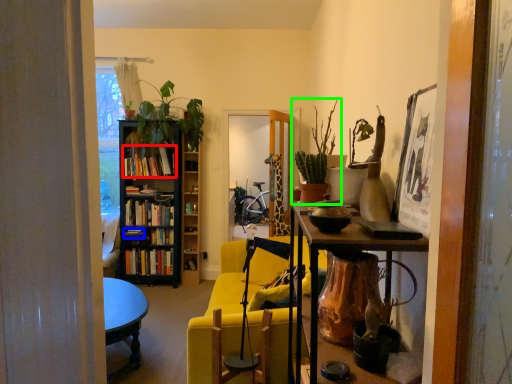
Question: Estimate the real-world distances between objects in this image. Which object is closer to book (highlighted by a red box), book (highlighted by a blue box) or houseplant (highlighted by a green box)?

Choices:
 (A) book
 (B) houseplant

Answer: (A)